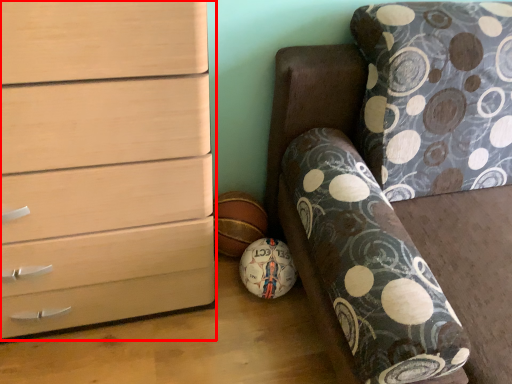
Question: From the image's perspective, where is chest of drawers (annotated by the red box) located relative to furniture?

Choices:
 (A) below
 (B) above

Answer: (B)